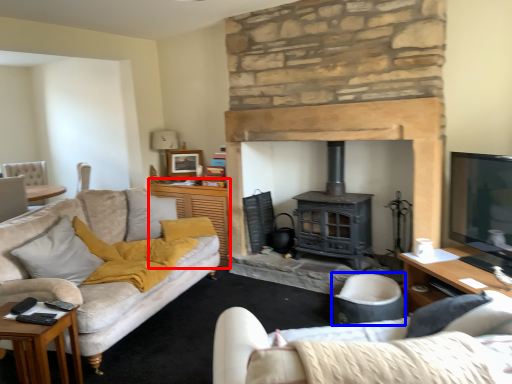
Question: Among these objects, which one is farthest to the camera, table (highlighted by a red box) or armchair (highlighted by a blue box)?

Choices:
 (A) table
 (B) armchair

Answer: (A)